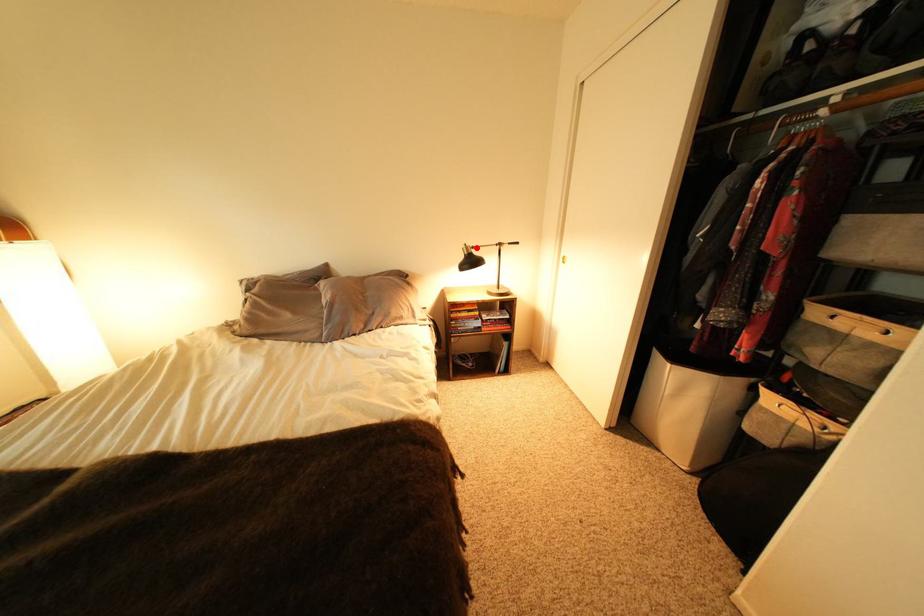
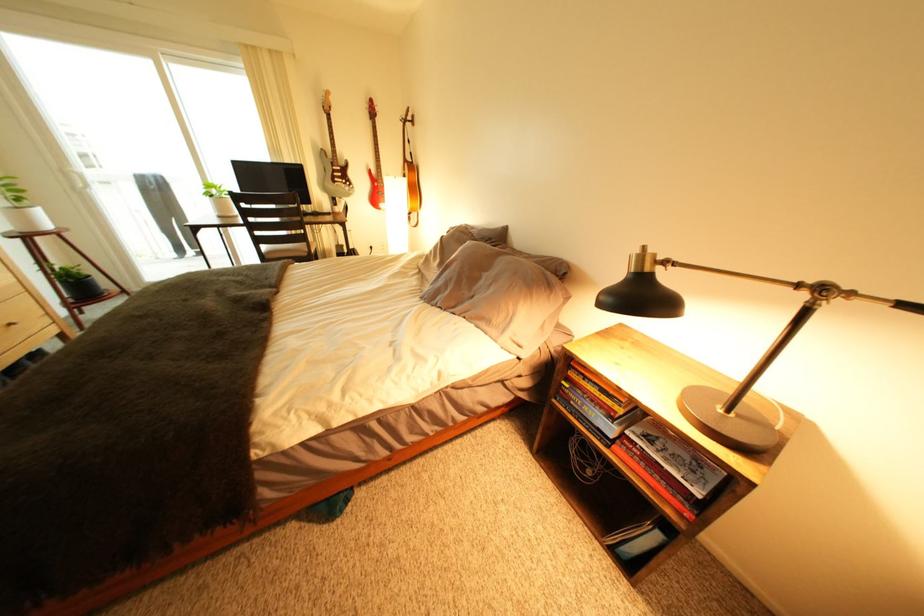
In the second image, find the point that corresponds to the highlighted location in the first image.

(650, 253)